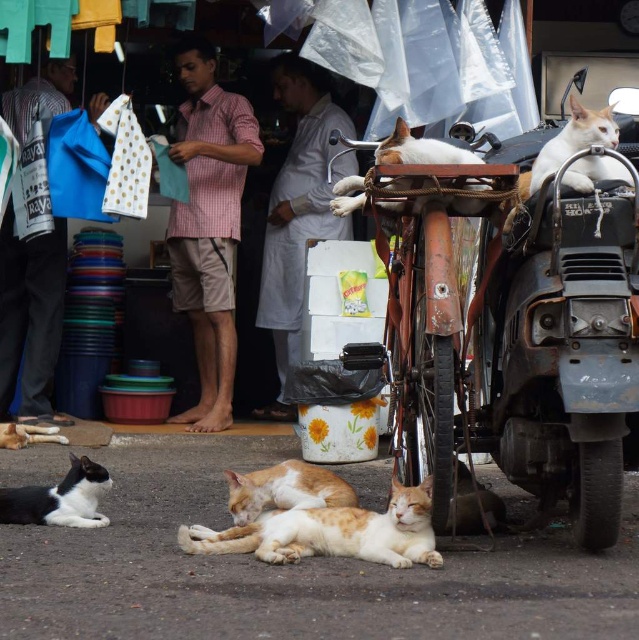
You are a photographer trying to capture both the white fur cat at upper right and the white fur cat at center in a single frame. Given that your camera has a fixed focal length, which cat requires you to adjust your position closer to the subject to ensure it appears larger in the photo?

The white fur cat at upper right requires you to adjust your position closer to the subject because its width is less than the white fur cat at center, so to make it appear larger in the photo, you need to move closer to it.

You are a photographer aiming to capture the white fur cat at upper right without the rusty metal motorcycle at upper right blocking the view. Is this possible given their positions?

The rusty metal motorcycle at upper right is in front of the white fur cat at upper right, so it would block the view. To capture the cat without the motorcycle blocking, you would need to adjust your angle or position to go around the motorcycle.